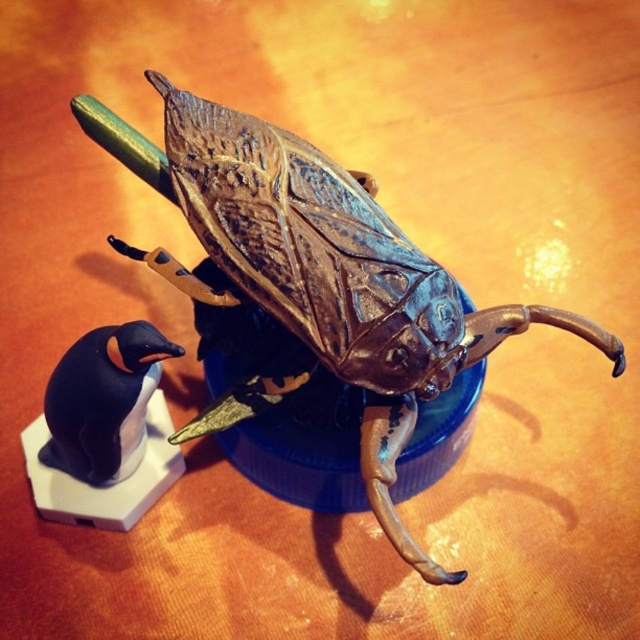
Does shiny metallic beetle at center appear on the left side of black matte penguin at lower left?

No, shiny metallic beetle at center is not to the left of black matte penguin at lower left.

Which is above, shiny metallic beetle at center or black matte penguin at lower left?

shiny metallic beetle at center is above.

This screenshot has width=640, height=640. What do you see at coordinates (314, 280) in the screenshot?
I see `shiny metallic beetle at center` at bounding box center [314, 280].

Find the location of a particular element. shiny metallic beetle at center is located at coordinates (314, 280).